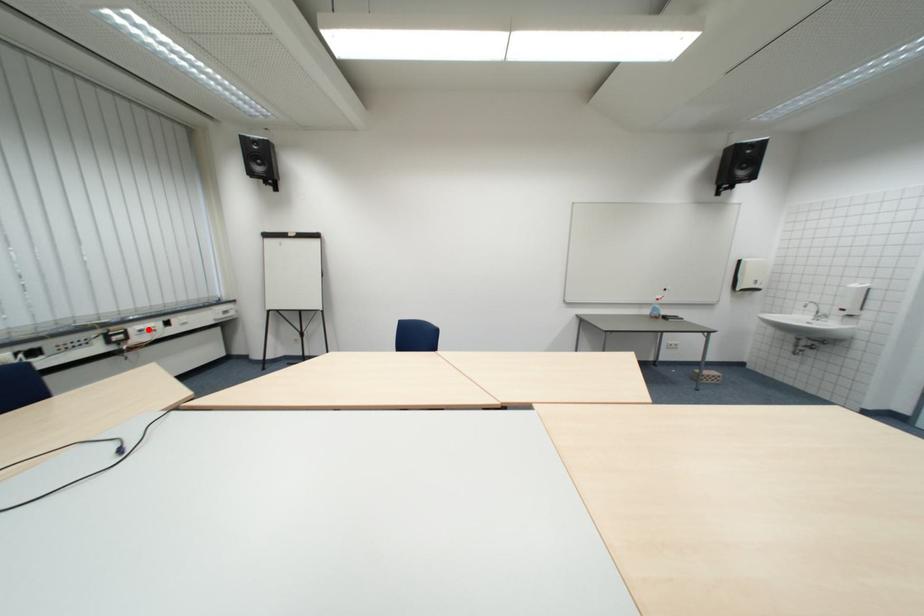
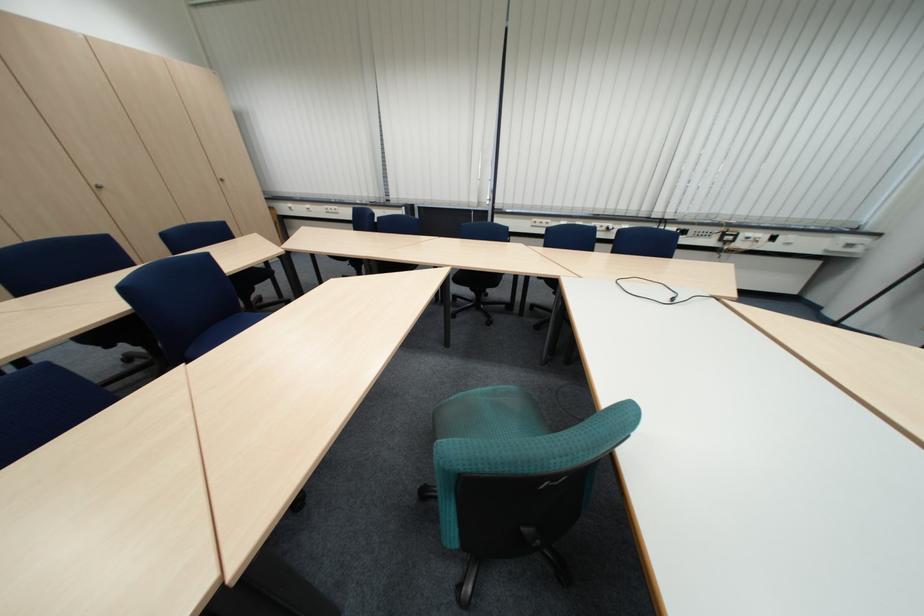
The point at the highlighted location is marked in the first image. Where is the corresponding point in the second image?

(759, 235)